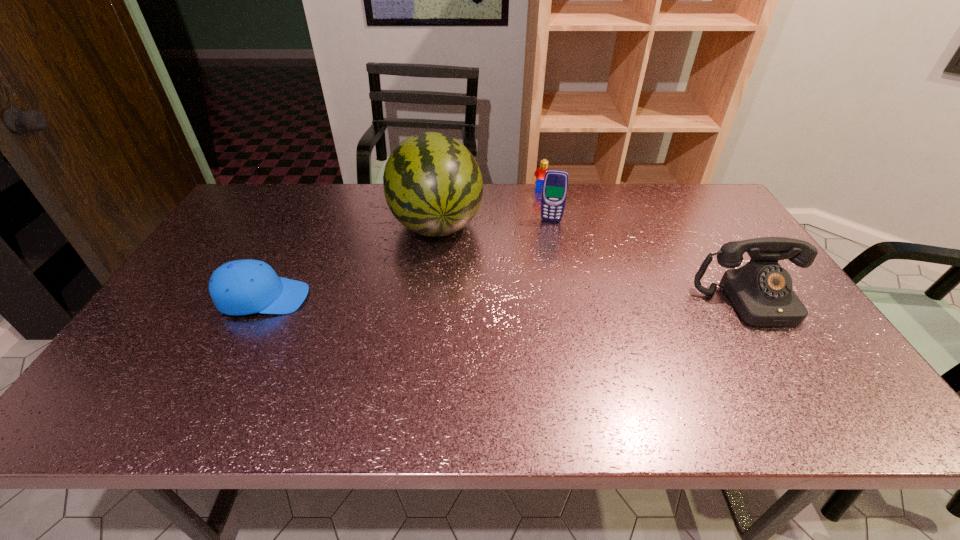
I want to click on object that is positioned at the left edge, so click(x=241, y=287).

Locate an element on the screen. object that is at the right edge is located at coordinates (761, 291).

This screenshot has width=960, height=540. Find the location of `free space at the far edge of the desktop`. free space at the far edge of the desktop is located at coordinates (618, 191).

The image size is (960, 540). Identify the location of free location at the near edge. (309, 373).

The image size is (960, 540). In the image, there is a desktop. What are the coordinates of `free region at the right edge` in the screenshot? It's located at (712, 247).

Locate an element on the screen. The width and height of the screenshot is (960, 540). free location at the far left corner is located at coordinates (234, 213).

Image resolution: width=960 pixels, height=540 pixels. I want to click on free spot between the tallest object and the cellular telephone, so click(x=493, y=222).

You are a GUI agent. You are given a task and a screenshot of the screen. Output one action in this format:
    pyautogui.click(x=<x>, y=<y>)
    Task: Click on the vacant space in between the cellular telephone and the cap
    
    Given the screenshot: What is the action you would take?
    pyautogui.click(x=407, y=259)

Find the location of `empty location between the telephone and the leftmost object`. empty location between the telephone and the leftmost object is located at coordinates (507, 300).

Find the location of a particular element. vacant space in between the telephone and the leftmost object is located at coordinates (507, 300).